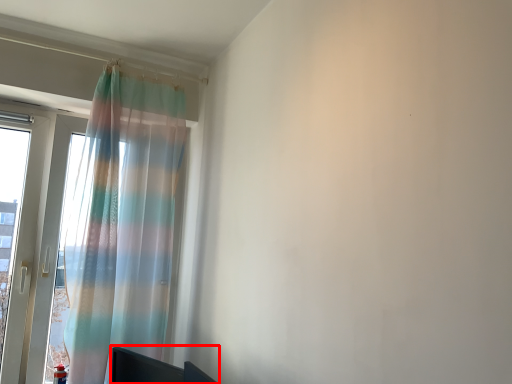
Question: From the image's perspective, what is the correct spatial relationship of furniture (annotated by the red box) in relation to curtain?

Choices:
 (A) above
 (B) below

Answer: (B)